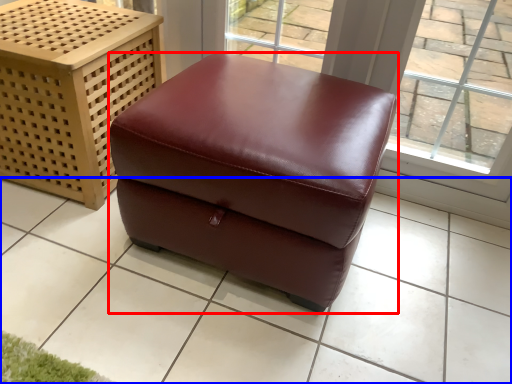
Question: Among these objects, which one is farthest to the camera, furniture (highlighted by a red box) or tile (highlighted by a blue box)?

Choices:
 (A) furniture
 (B) tile

Answer: (A)